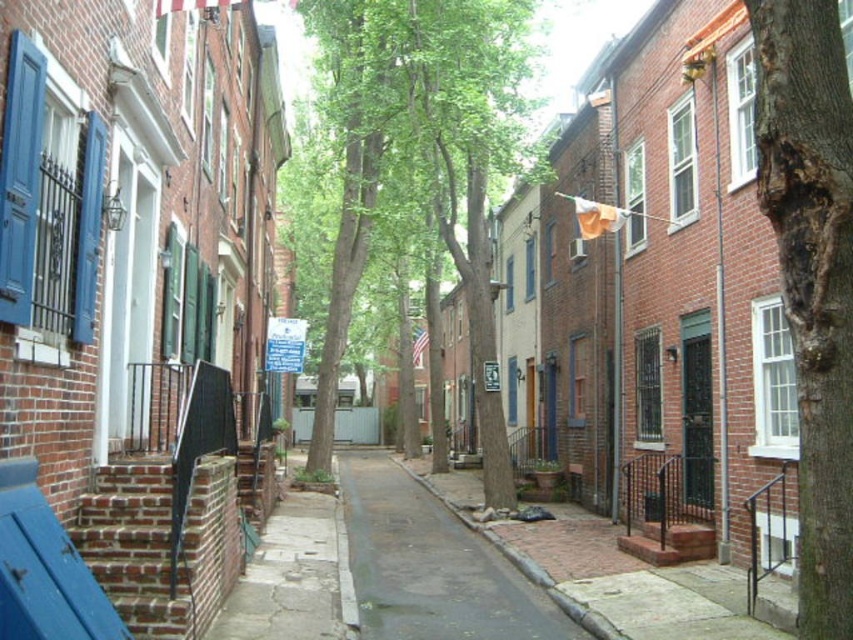
Describe the element at coordinates (438, 140) in the screenshot. I see `green leafy tree at center` at that location.

Identify the location of green leafy tree at center. The width and height of the screenshot is (853, 640). (438, 140).

Does point (474, 285) come farther from viewer compared to point (379, 481)?

That is False.

Can you confirm if green leafy tree at center is bigger than dark gray asphalt at center?

Yes.

What do you see at coordinates (438, 140) in the screenshot? The height and width of the screenshot is (640, 853). I see `green leafy tree at center` at bounding box center [438, 140].

At what (x,y) coordinates should I click in order to perform the action: click on green leafy tree at center. Please return your answer as a coordinate pair (x, y). Image resolution: width=853 pixels, height=640 pixels. Looking at the image, I should click on (438, 140).

Is rough bark tree at right shorter than dark gray asphalt at center?

No.

What do you see at coordinates (811, 276) in the screenshot? I see `rough bark tree at right` at bounding box center [811, 276].

Locate an element on the screen. This screenshot has width=853, height=640. rough bark tree at right is located at coordinates (811, 276).